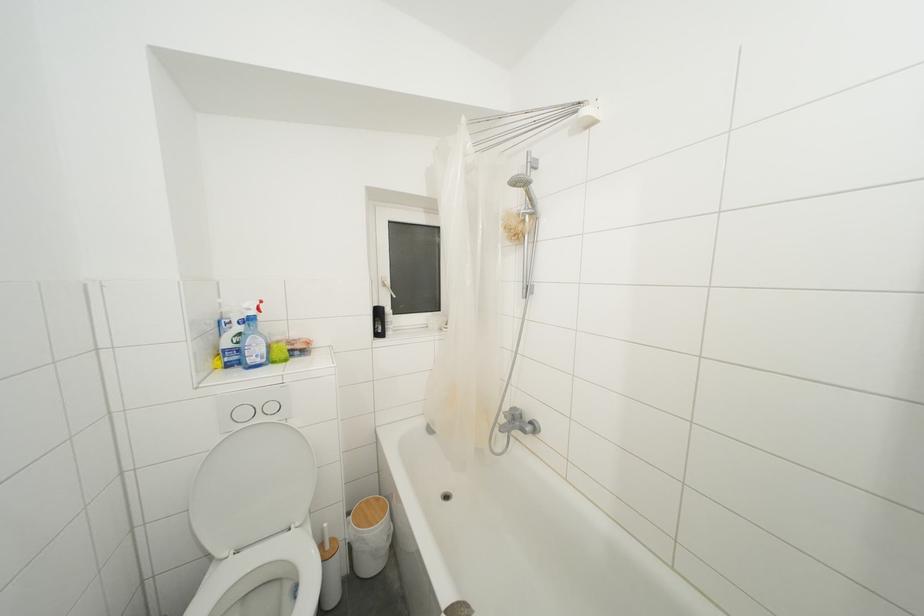
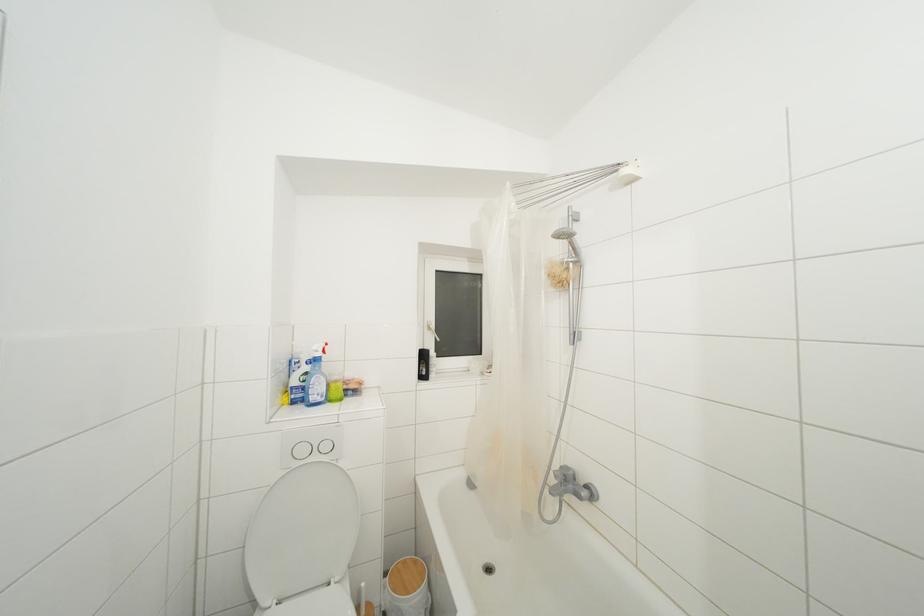
Locate, in the second image, the point that corresponds to pixel 383 318 in the first image.

(428, 361)